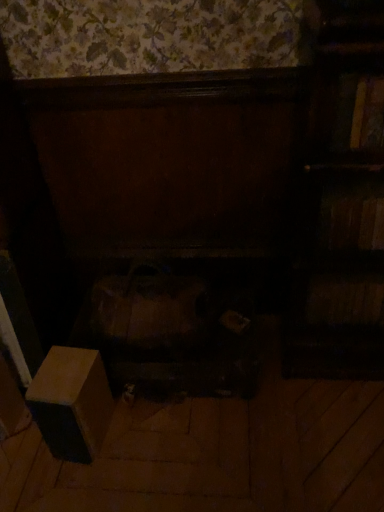
You are a GUI agent. You are given a task and a screenshot of the screen. Output one action in this format:
    pyautogui.click(x=<x>, y=<y>)
    Task: Click on the vacant space that is to the left of matte brown cardboard box at lower left
    The image size is (384, 512).
    Given the screenshot: What is the action you would take?
    pyautogui.click(x=27, y=459)